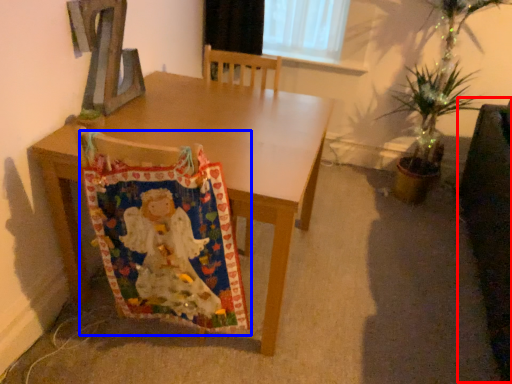
Question: Which object appears closest to the camera in this image, swivel chair (highlighted by a red box) or blanket (highlighted by a blue box)?

Choices:
 (A) swivel chair
 (B) blanket

Answer: (A)